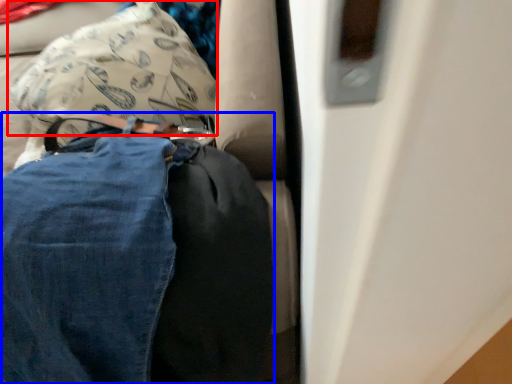
Question: Which object is further to the camera taking this photo, pillow (highlighted by a red box) or trousers (highlighted by a blue box)?

Choices:
 (A) pillow
 (B) trousers

Answer: (A)